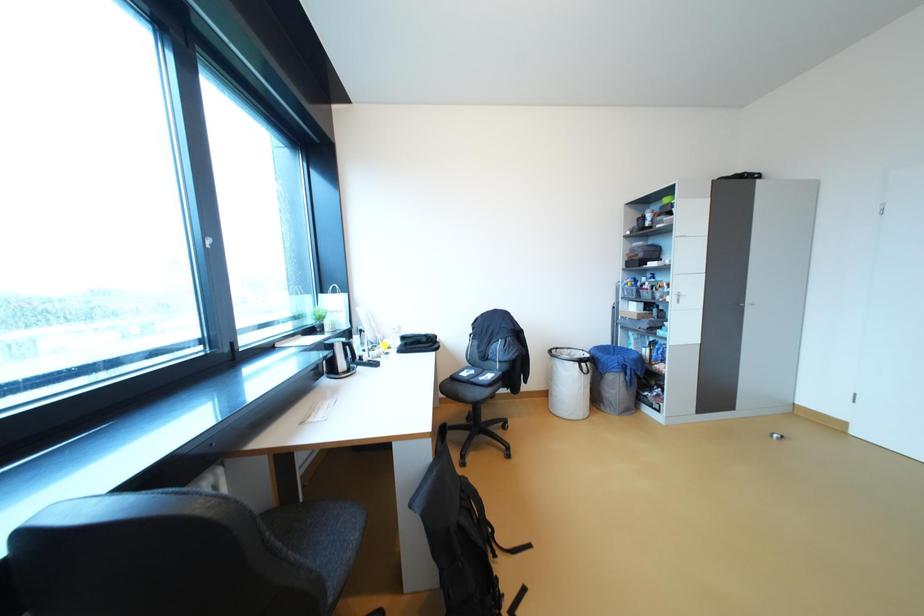
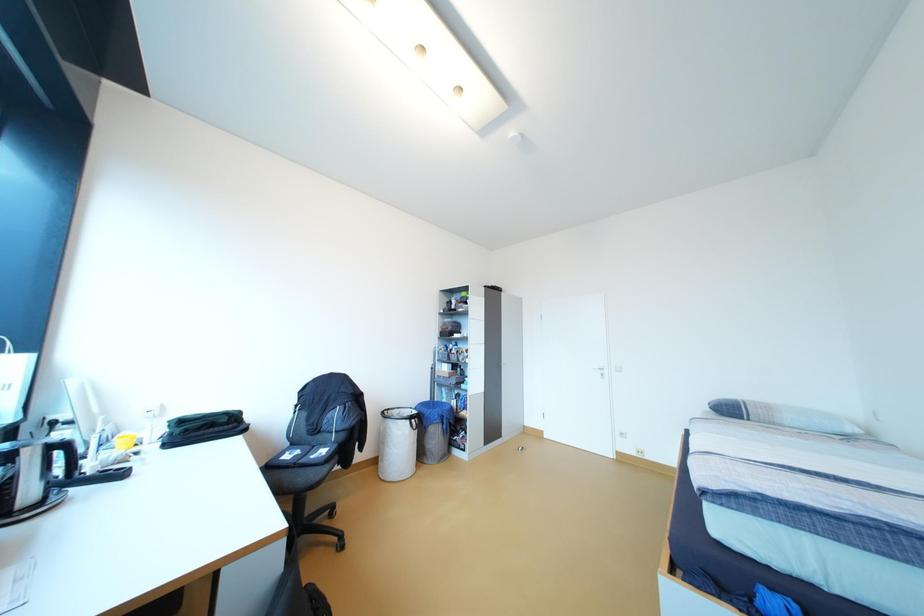
Question: The images are taken continuously from a first-person perspective. In which direction is your viewpoint rotating?

Choices:
 (A) Left
 (B) Right
 (C) Up
 (D) Down

Answer: (B)